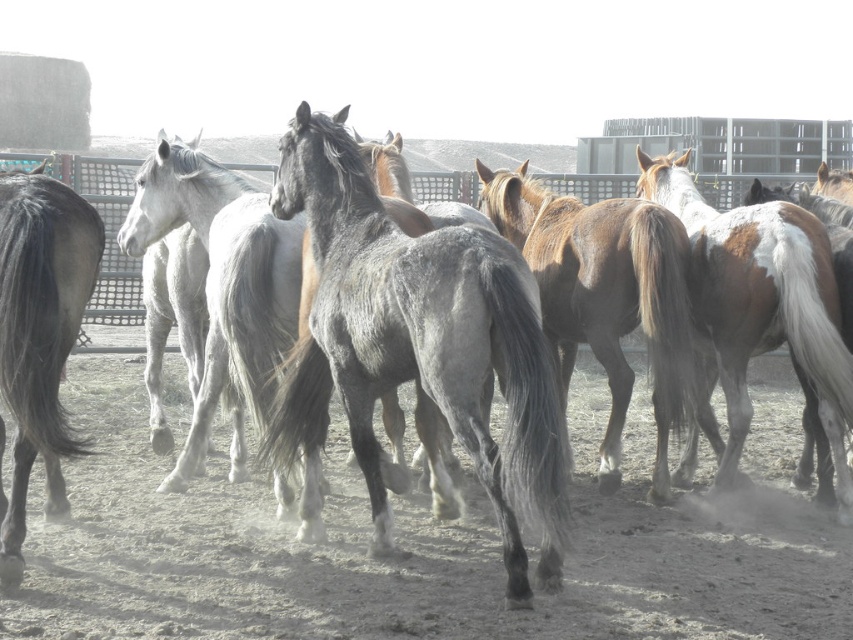
Between gray dusty ground at center and brown glossy horse at center, which one is positioned higher?

Positioned higher is brown glossy horse at center.

How far apart are gray dusty ground at center and brown glossy horse at center?

A distance of 1.12 meters exists between gray dusty ground at center and brown glossy horse at center.

Is point (756, 538) in front of point (519, 236)?

Yes.

In order to click on gray dusty ground at center in this screenshot , I will do `click(410, 552)`.

Can you confirm if gray dusty ground at center is wider than gray matte horse at left?

Yes.

Which is behind, point (677, 506) or point (45, 236)?

The point (677, 506) is behind.

Where is `gray dusty ground at center`? The width and height of the screenshot is (853, 640). gray dusty ground at center is located at coordinates [410, 552].

In the scene shown: Measure the distance from gray dusty ground at center to gray textured horse at center.

gray dusty ground at center and gray textured horse at center are 28.75 inches apart.

Who is positioned more to the left, gray dusty ground at center or gray textured horse at center?

gray textured horse at center

Which is behind, point (45, 547) or point (428, 388)?

Positioned behind is point (45, 547).

The height and width of the screenshot is (640, 853). I want to click on gray dusty ground at center, so click(x=410, y=552).